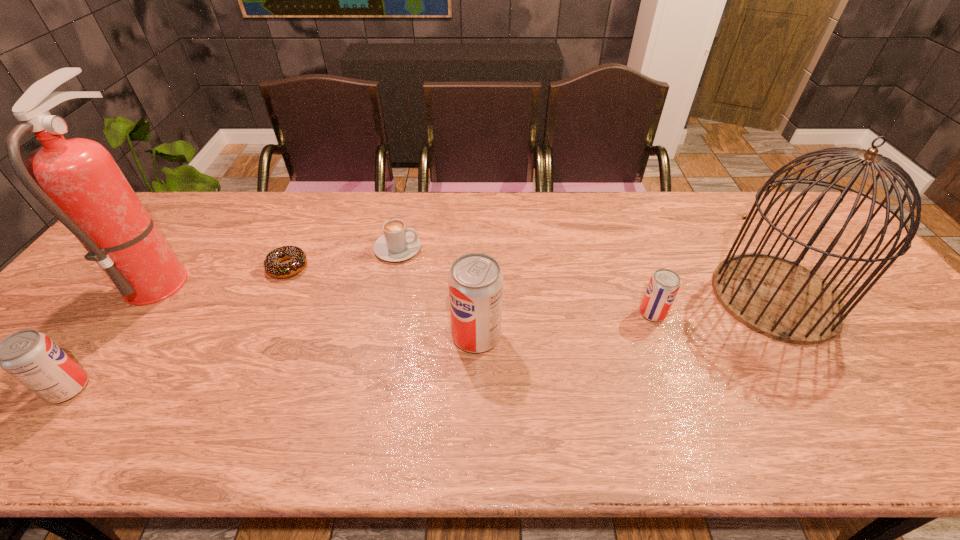
Identify the location of free location located 0.280m at the door of the birdcage. (612, 296).

Where is `object that is at the far edge`? object that is at the far edge is located at coordinates [397, 244].

Identify the location of object at the near edge. (31, 357).

At what (x,y) coordinates should I click in order to perform the action: click on soda that is at the left edge. Please return your answer as a coordinate pair (x, y). The height and width of the screenshot is (540, 960). Looking at the image, I should click on (31, 357).

Identify the location of fire extinguisher that is at the left edge. The height and width of the screenshot is (540, 960). (x=77, y=180).

Find the location of a particular element. Image resolution: width=960 pixels, height=540 pixels. object at the right edge is located at coordinates (778, 298).

Identify the location of object that is positioned at the near left corner. The width and height of the screenshot is (960, 540). (31, 357).

Locate an element on the screen. vacant area at the far edge is located at coordinates (653, 213).

Locate an element on the screen. This screenshot has height=540, width=960. vacant space at the near edge of the desktop is located at coordinates (735, 384).

Where is `free spot at the left edge of the desktop`? free spot at the left edge of the desktop is located at coordinates (90, 296).